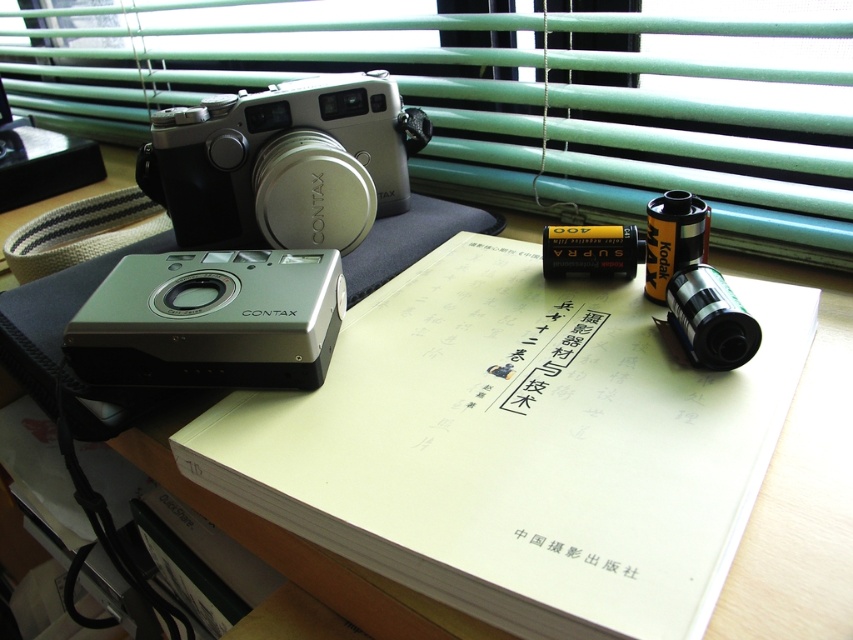
Question: Considering the relative positions of green matte blinds at upper center and silver metallic camera at upper left in the image provided, where is green matte blinds at upper center located with respect to silver metallic camera at upper left?

Choices:
 (A) left
 (B) right

Answer: (A)

Question: Which object is farther from the camera taking this photo?

Choices:
 (A) silver metallic camera at lower left
 (B) green matte blinds at upper center
 (C) silver metallic camera at upper left

Answer: (C)

Question: Does green matte blinds at upper center have a larger size compared to silver metallic camera at upper left?

Choices:
 (A) no
 (B) yes

Answer: (B)

Question: Does silver metallic camera at upper left have a smaller size compared to silver metallic camera at lower left?

Choices:
 (A) no
 (B) yes

Answer: (A)

Question: Among these objects, which one is farthest from the camera?

Choices:
 (A) silver metallic camera at lower left
 (B) silver metallic camera at upper left

Answer: (B)

Question: Which point is closer to the camera?

Choices:
 (A) silver metallic camera at lower left
 (B) green matte blinds at upper center

Answer: (A)